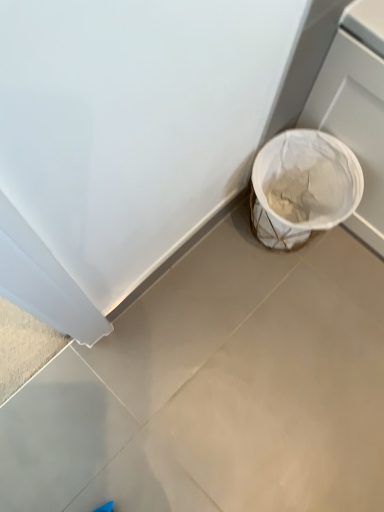
Question: Is white woven basket at lower right in front of or behind white matte trash can at lower right in the image?

Choices:
 (A) front
 (B) behind

Answer: (B)

Question: From the image's perspective, is white woven basket at lower right positioned above or below white matte trash can at lower right?

Choices:
 (A) below
 (B) above

Answer: (B)

Question: Looking at their shapes, would you say white woven basket at lower right is wider or thinner than white matte trash can at lower right?

Choices:
 (A) wide
 (B) thin

Answer: (B)

Question: Looking at the image, does white matte trash can at lower right seem bigger or smaller compared to white woven basket at lower right?

Choices:
 (A) big
 (B) small

Answer: (B)

Question: From the image's perspective, relative to white woven basket at lower right, is white matte trash can at lower right above or below?

Choices:
 (A) below
 (B) above

Answer: (A)

Question: In terms of height, does white matte trash can at lower right look taller or shorter compared to white woven basket at lower right?

Choices:
 (A) tall
 (B) short

Answer: (B)

Question: Considering the relative positions of white matte trash can at lower right and white woven basket at lower right in the image provided, is white matte trash can at lower right to the left or to the right of white woven basket at lower right?

Choices:
 (A) left
 (B) right

Answer: (A)